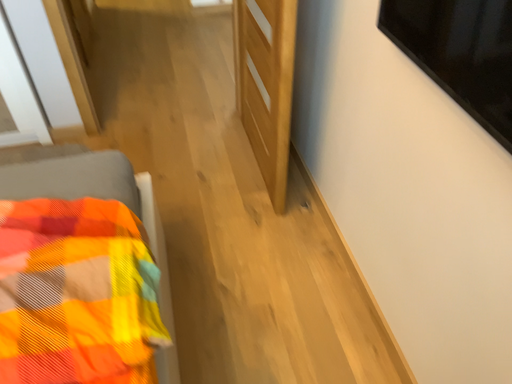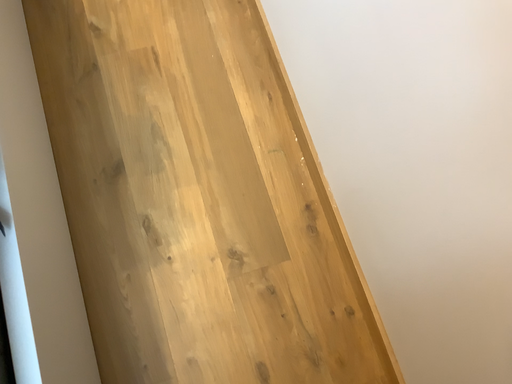
Question: How did the camera likely rotate when shooting the video?

Choices:
 (A) rotated left
 (B) rotated right

Answer: (B)